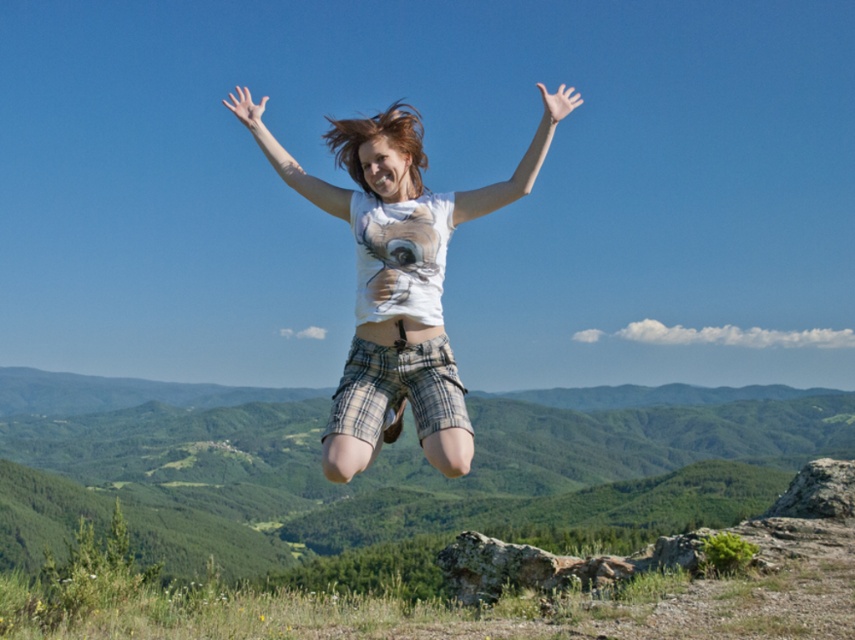
Question: Is white cotton t-shirt at center wider than white matte arm at center?

Choices:
 (A) yes
 (B) no

Answer: (B)

Question: Does white cotton t-shirt at center appear on the right side of white matte arm at center?

Choices:
 (A) no
 (B) yes

Answer: (B)

Question: Among these points, which one is farthest from the camera?

Choices:
 (A) (569, 109)
 (B) (351, 129)
 (C) (252, 120)

Answer: (C)

Question: Which object appears closest to the camera in this image?

Choices:
 (A) white matte arm at upper center
 (B) white matte arm at center
 (C) white cotton t-shirt at center

Answer: (C)

Question: Based on their relative distances, which object is farther from the white matte arm at upper center?

Choices:
 (A) white matte arm at center
 (B) white cotton t-shirt at center

Answer: (A)

Question: Is white cotton t-shirt at center to the left of white matte arm at center from the viewer's perspective?

Choices:
 (A) yes
 (B) no

Answer: (B)